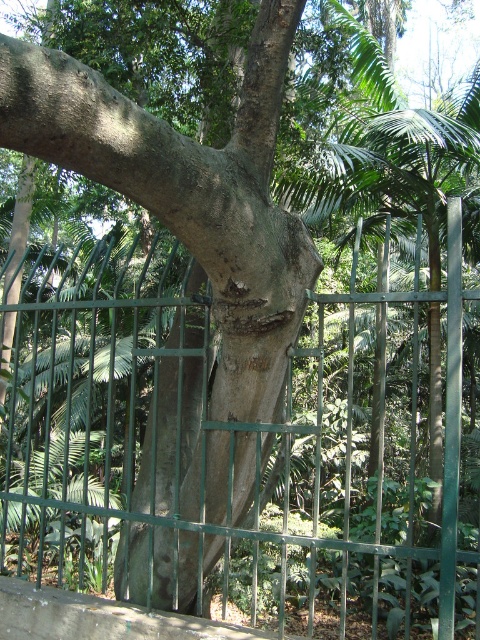
In the scene shown: Does green metal fence at center have a lesser height compared to smooth gray bark at center?

Incorrect, green metal fence at center's height does not fall short of smooth gray bark at center's.

Can you confirm if green metal fence at center is positioned above smooth gray bark at center?

No, green metal fence at center is not above smooth gray bark at center.

In the scene shown: Measure the distance between green metal fence at center and camera.

A distance of 8.92 feet exists between green metal fence at center and camera.

I want to click on green metal fence at center, so click(x=229, y=445).